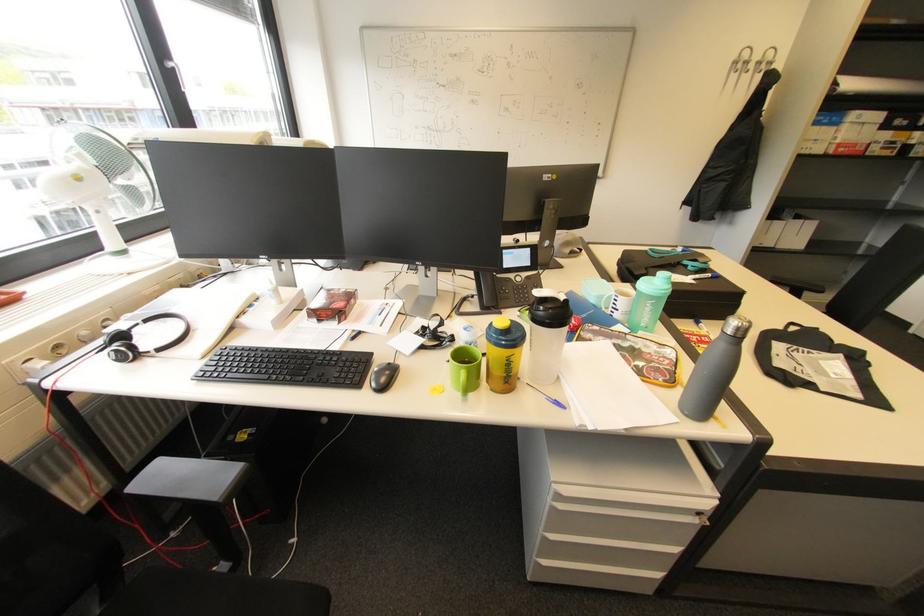
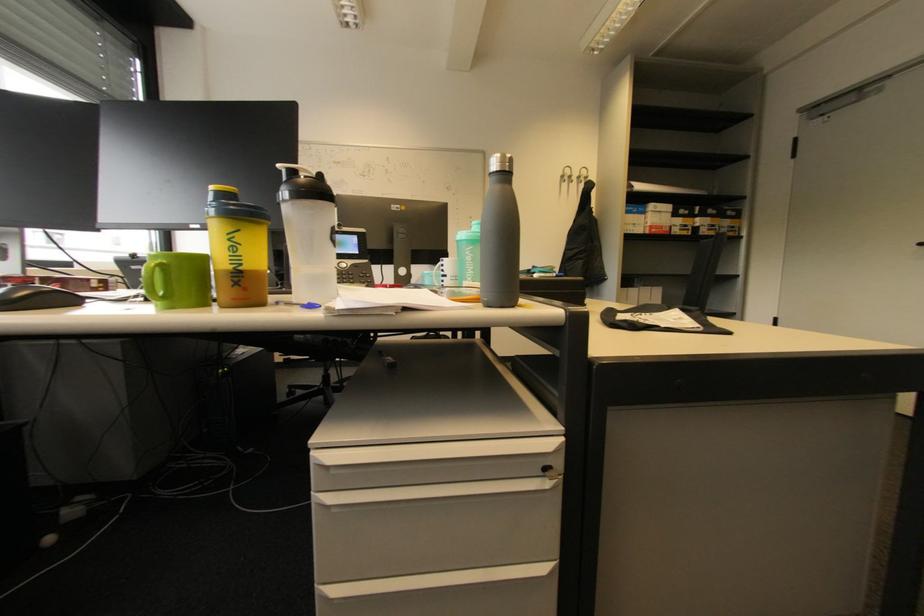
In the second image, find the point that corresponds to point (740, 63) in the first image.

(567, 177)